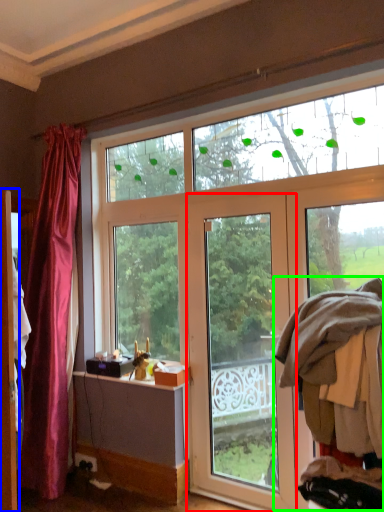
Question: Considering the real-world distances, which object is closest to door (highlighted by a red box)? screen door (highlighted by a blue box) or laundry (highlighted by a green box).

Choices:
 (A) screen door
 (B) laundry

Answer: (B)